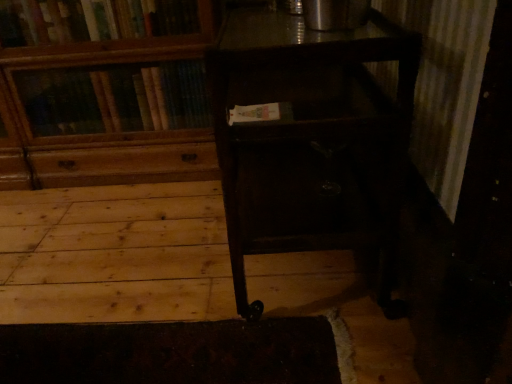
Question: From the image's perspective, is wooden bookcase at upper left located above dark wood table at center?

Choices:
 (A) yes
 (B) no

Answer: (A)

Question: Is wooden bookcase at upper left taller than dark wood table at center?

Choices:
 (A) yes
 (B) no

Answer: (A)

Question: Are wooden bookcase at upper left and dark wood table at center making contact?

Choices:
 (A) yes
 (B) no

Answer: (B)

Question: Can you confirm if wooden bookcase at upper left is positioned to the left of dark wood table at center?

Choices:
 (A) no
 (B) yes

Answer: (B)

Question: Can you confirm if wooden bookcase at upper left is wider than dark wood table at center?

Choices:
 (A) yes
 (B) no

Answer: (B)

Question: From a real-world perspective, is wooden bookcase at upper left located higher than dark wood table at center?

Choices:
 (A) no
 (B) yes

Answer: (B)

Question: Considering the relative sizes of dark wood table at center and wooden bookcase at upper left in the image provided, is dark wood table at center thinner than wooden bookcase at upper left?

Choices:
 (A) yes
 (B) no

Answer: (B)

Question: Is dark wood table at center wider than wooden bookcase at upper left?

Choices:
 (A) no
 (B) yes

Answer: (B)

Question: Can you confirm if dark wood table at center is positioned to the left of wooden bookcase at upper left?

Choices:
 (A) no
 (B) yes

Answer: (A)

Question: Is dark wood table at center located outside wooden bookcase at upper left?

Choices:
 (A) yes
 (B) no

Answer: (A)

Question: Is dark wood table at center aimed at wooden bookcase at upper left?

Choices:
 (A) no
 (B) yes

Answer: (A)

Question: Is dark wood table at center oriented away from wooden bookcase at upper left?

Choices:
 (A) no
 (B) yes

Answer: (A)

Question: In the image, is wooden bookcase at upper left positioned in front of or behind dark wood table at center?

Choices:
 (A) front
 (B) behind

Answer: (B)